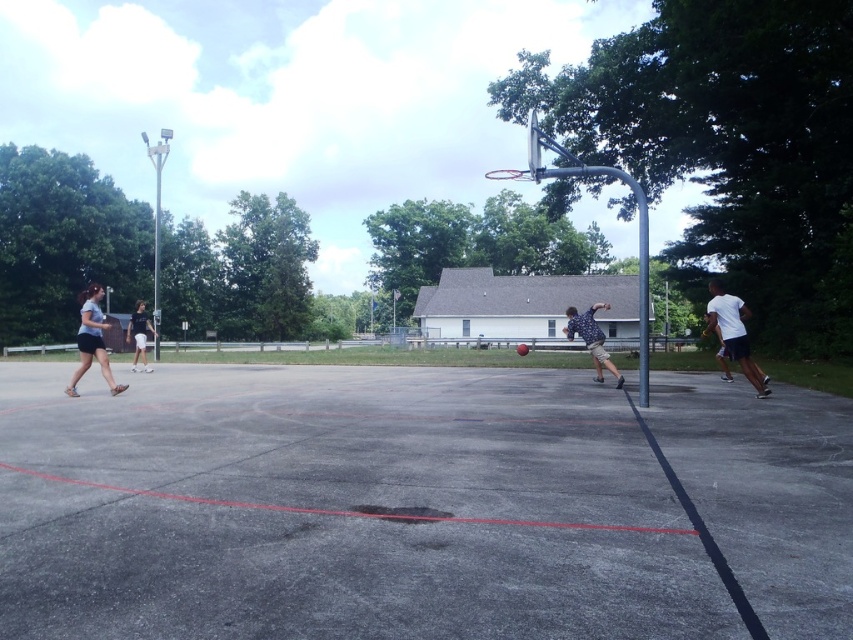
What do you see at coordinates (733, 332) in the screenshot?
I see `white matte shirt at right` at bounding box center [733, 332].

In the scene shown: Is white matte shirt at right shorter than matte blue shorts at left?

Yes.

Does point (741, 340) lie in front of point (80, 365)?

Yes, it is.

In order to click on white matte shirt at right in this screenshot , I will do click(x=733, y=332).

Can you confirm if white matte shirt at right is taller than patterned shirt at center?

Yes.

Describe the element at coordinates (733, 332) in the screenshot. This screenshot has height=640, width=853. I see `white matte shirt at right` at that location.

Is point (738, 348) more distant than point (596, 326)?

No, (738, 348) is in front of (596, 326).

Identify the location of white matte shirt at right. Image resolution: width=853 pixels, height=640 pixels. (733, 332).

Can you confirm if silver metallic basketball hoop at center is positioned to the left of white cotton shorts at left?

No, silver metallic basketball hoop at center is not to the left of white cotton shorts at left.

Between point (643, 310) and point (146, 371), which one is positioned in front?

Positioned in front is point (643, 310).

The width and height of the screenshot is (853, 640). Identify the location of silver metallic basketball hoop at center. (589, 176).